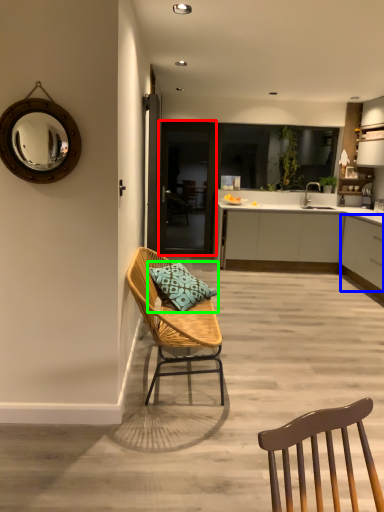
Question: Based on their relative distances, which object is nearer to glass door (highlighted by a red box)? Choose from cabinetry (highlighted by a blue box) and pillow (highlighted by a green box).

Choices:
 (A) cabinetry
 (B) pillow

Answer: (A)